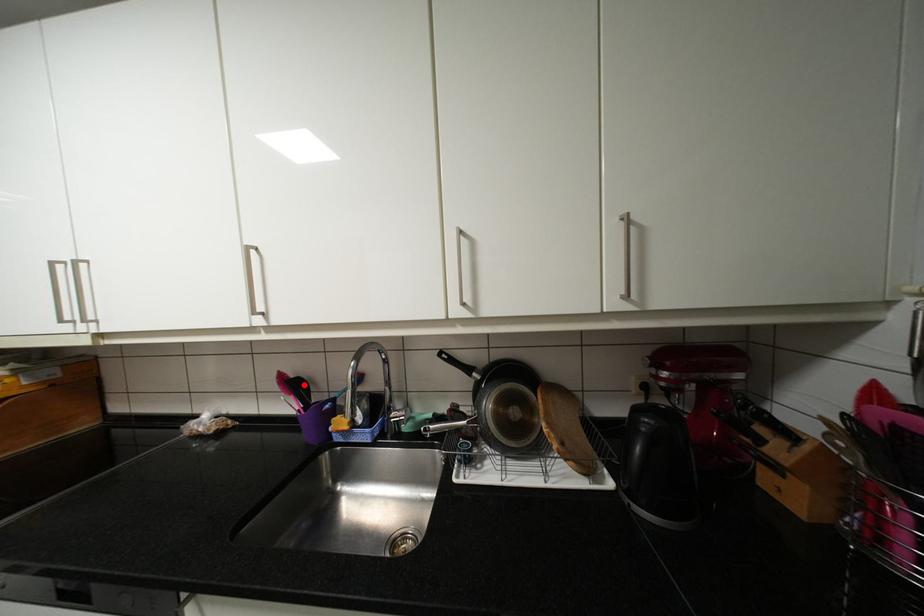
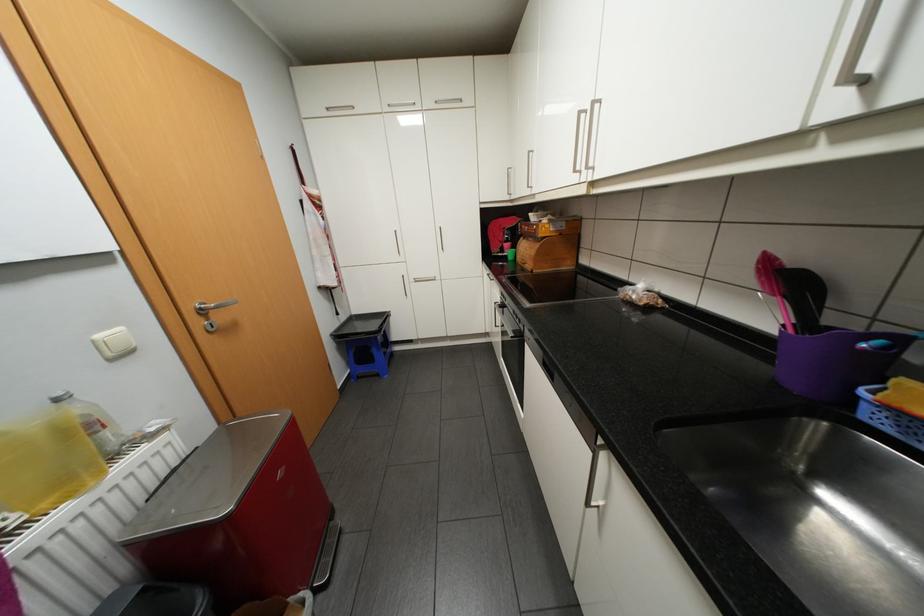
Where in the second image is the point corresponding to the highlighted location from the first image?

(800, 283)